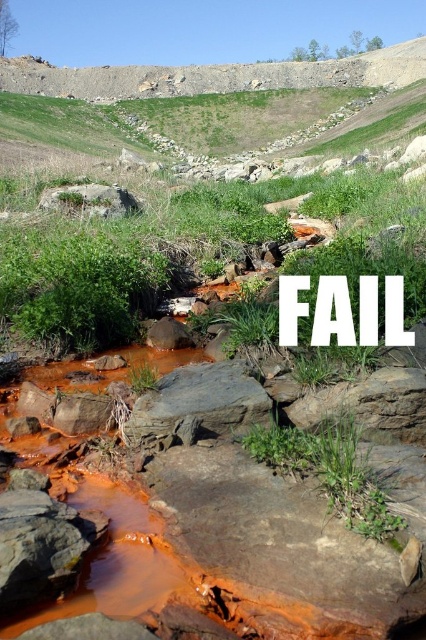
Question: Which of the following is the closest to the observer?

Choices:
 (A) (48, 84)
 (B) (89, 196)

Answer: (B)

Question: Is rusty rock cliff at upper center closer to the viewer compared to rusty rock at center?

Choices:
 (A) yes
 (B) no

Answer: (B)

Question: Is rusty rock cliff at upper center positioned at the back of rusty rock at center?

Choices:
 (A) yes
 (B) no

Answer: (A)

Question: Which object is farther from the camera taking this photo?

Choices:
 (A) rusty rock cliff at upper center
 (B) rusty rock at center

Answer: (A)

Question: Observing the image, what is the correct spatial positioning of rusty rock cliff at upper center in reference to rusty rock at center?

Choices:
 (A) above
 (B) below

Answer: (A)